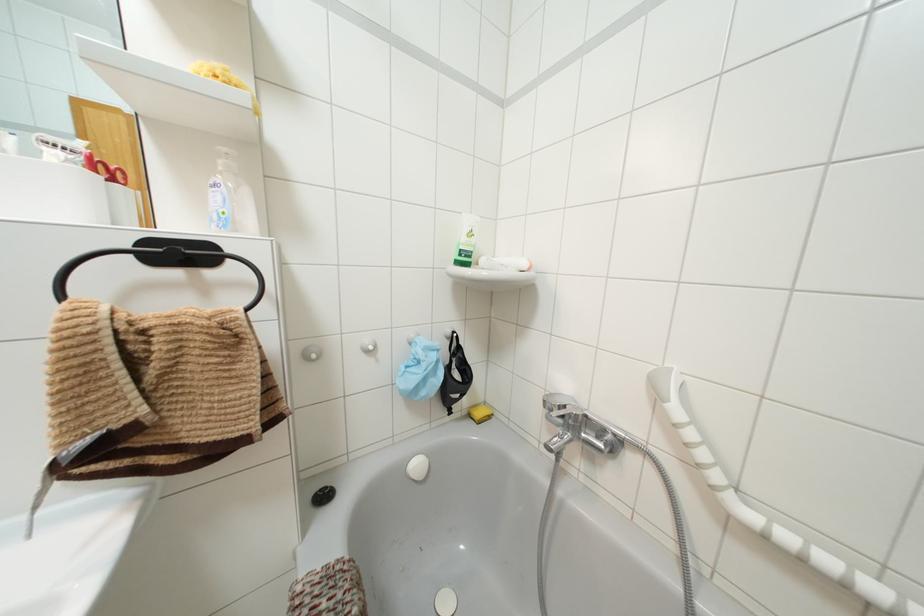
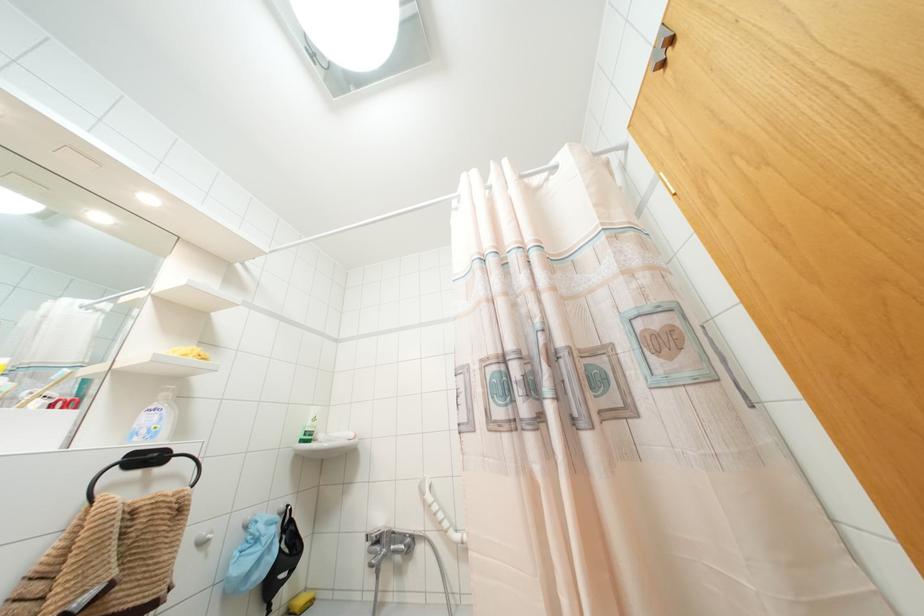
The point at (478, 413) is marked in the first image. Where is the corresponding point in the second image?

(299, 601)